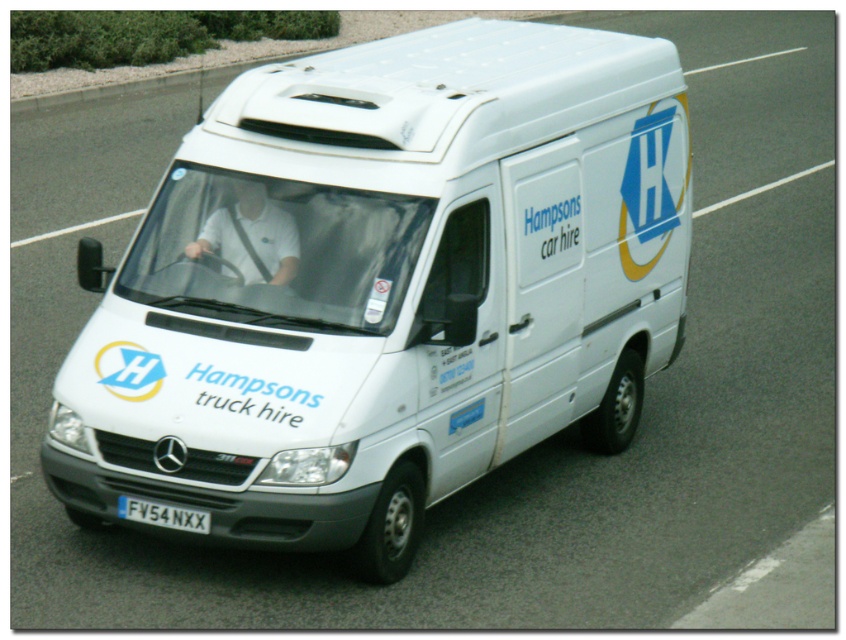
You are a delivery driver who needs to ensure your vehicle is properly registered. You look at the white matte van at center and the white plastic license plate at center. Which object is covering the other?

The white matte van at center is positioned over white plastic license plate at center, so it is covering the license plate.